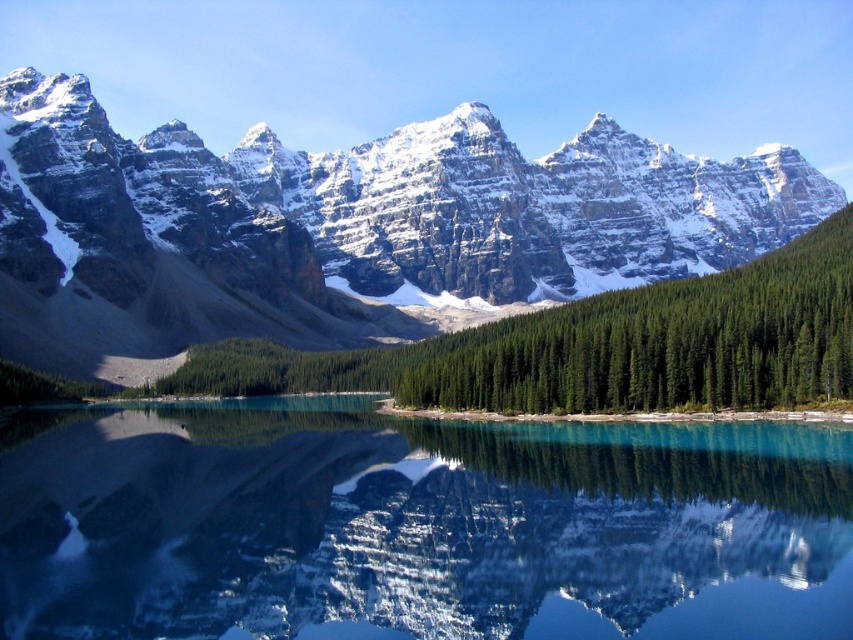
Can you confirm if clear glass water at center is positioned below snowy rock mountain range at upper center?

Yes, clear glass water at center is below snowy rock mountain range at upper center.

Can you confirm if clear glass water at center is positioned to the left of snowy rock mountain range at upper center?

Correct, you'll find clear glass water at center to the left of snowy rock mountain range at upper center.

Where is `clear glass water at center`? The height and width of the screenshot is (640, 853). clear glass water at center is located at coordinates (x=416, y=525).

Does clear glass water at center appear under green matte forest at center?

Correct, clear glass water at center is located below green matte forest at center.

Can you confirm if clear glass water at center is shorter than green matte forest at center?

Indeed, clear glass water at center has a lesser height compared to green matte forest at center.

Which is in front, point (688, 481) or point (555, 317)?

Point (688, 481)

Locate an element on the screen. The width and height of the screenshot is (853, 640). clear glass water at center is located at coordinates (416, 525).

Can you confirm if snowy rock mountain range at upper center is positioned to the left of green matte forest at center?

Indeed, snowy rock mountain range at upper center is positioned on the left side of green matte forest at center.

Does snowy rock mountain range at upper center appear on the right side of green matte forest at center?

Incorrect, snowy rock mountain range at upper center is not on the right side of green matte forest at center.

What do you see at coordinates (343, 228) in the screenshot?
I see `snowy rock mountain range at upper center` at bounding box center [343, 228].

Where is `snowy rock mountain range at upper center`? Image resolution: width=853 pixels, height=640 pixels. snowy rock mountain range at upper center is located at coordinates (343, 228).